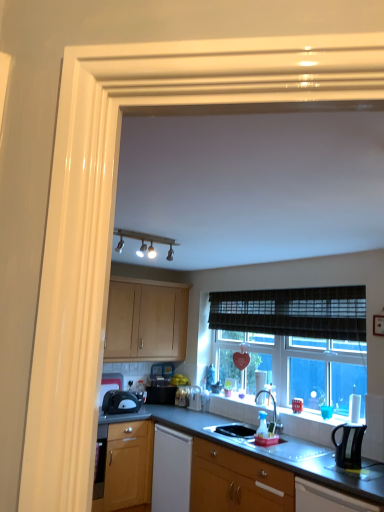
Identify the location of blank area beneath matte black toaster at lower left, which is counted as the 1th kitchen appliance, starting from the back (from a real-world perspective). (130, 409).